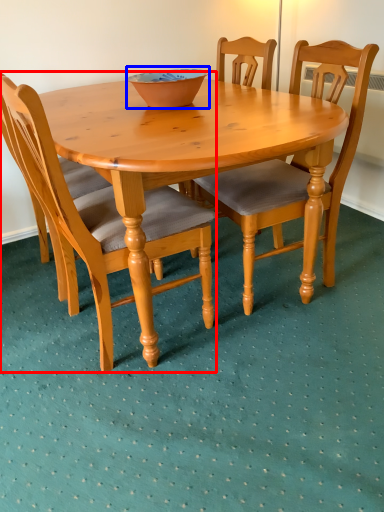
Question: Which point is further to the camera, chair (highlighted by a red box) or bowl (highlighted by a blue box)?

Choices:
 (A) chair
 (B) bowl

Answer: (B)